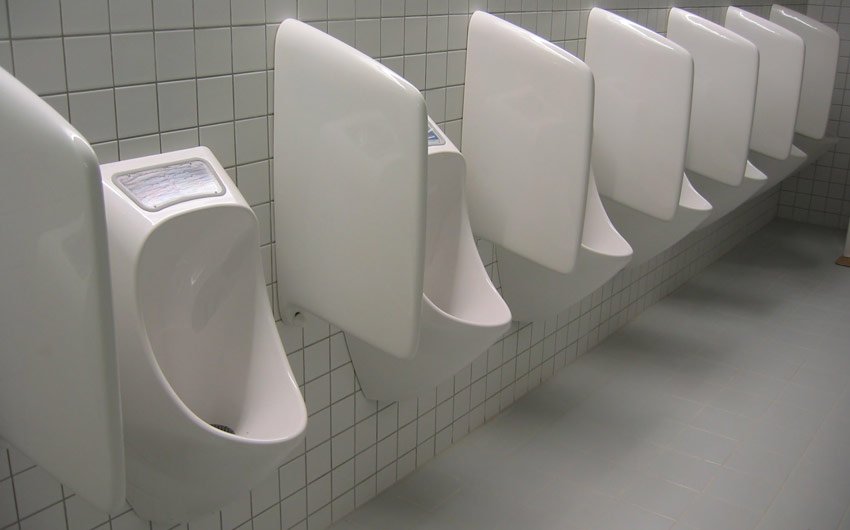
Locate an element on the screen. The image size is (850, 530). urinals is located at coordinates (189, 263), (471, 295), (615, 251), (686, 212), (743, 193), (779, 167), (822, 149).